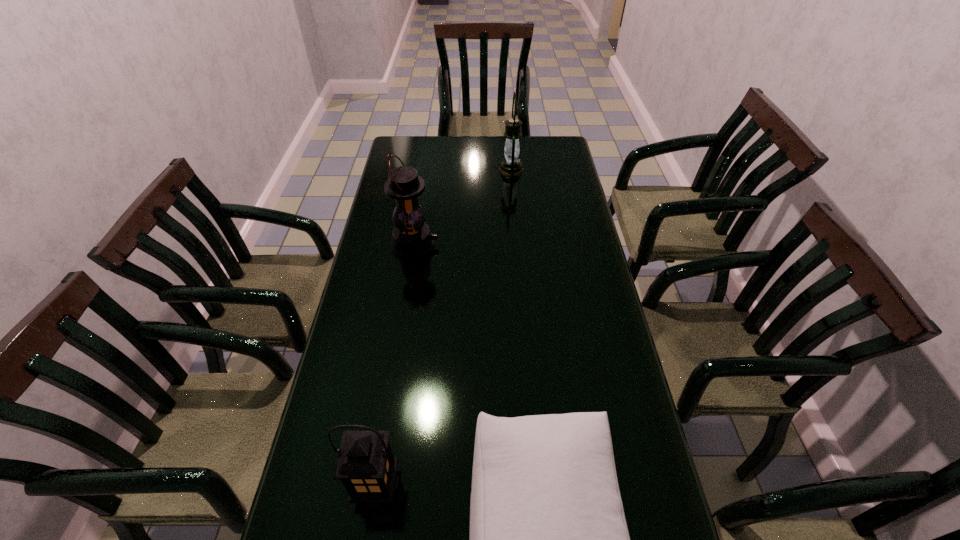
Where is `vacant region between the second nearest lantern and the shortest lantern`? This screenshot has width=960, height=540. vacant region between the second nearest lantern and the shortest lantern is located at coordinates (396, 365).

Image resolution: width=960 pixels, height=540 pixels. In order to click on object that is the second nearest to the second farthest lantern in this screenshot , I will do `click(548, 535)`.

Select which object appears as the closest to the nearest lantern. Please provide its 2D coordinates. Your answer should be formatted as a tuple, i.e. [(x, y)], where the tuple contains the x and y coordinates of a point satisfying the conditions above.

[(548, 535)]

Locate which lantern is the second closest to the shortest lantern. Please provide its 2D coordinates. Your answer should be formatted as a tuple, i.e. [(x, y)], where the tuple contains the x and y coordinates of a point satisfying the conditions above.

[(511, 166)]

Where is `the second closest lantern relative to the shortest lantern`? the second closest lantern relative to the shortest lantern is located at coordinates (511, 166).

I want to click on vacant area in the image that satisfies the following two spatial constraints: 1. above the second farthest object, indicating its light source; 2. on the front side of the nearest lantern, so click(x=378, y=485).